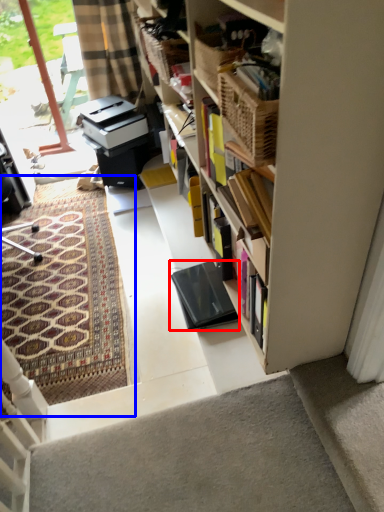
Question: Among these objects, which one is nearest to the camera, equipment (highlighted by a red box) or doormat (highlighted by a blue box)?

Choices:
 (A) equipment
 (B) doormat

Answer: (A)